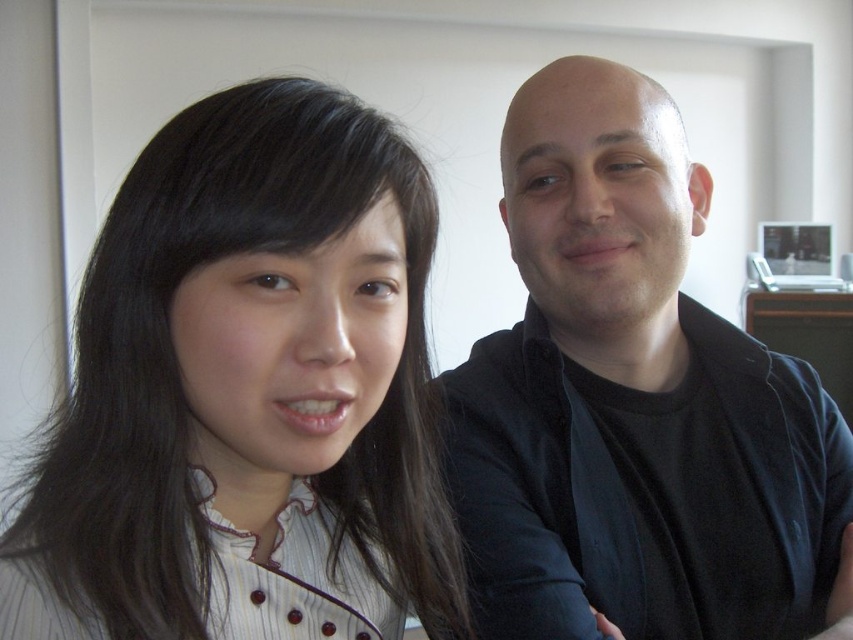
Question: Does matte black hair at left lie in front of black matte shirt at right?

Choices:
 (A) yes
 (B) no

Answer: (A)

Question: From the image, what is the correct spatial relationship of matte black hair at left in relation to black matte shirt at right?

Choices:
 (A) right
 (B) left

Answer: (B)

Question: Which point appears closest to the camera in this image?

Choices:
 (A) (415, 252)
 (B) (537, 499)

Answer: (A)

Question: Among these objects, which one is farthest from the camera?

Choices:
 (A) matte black hair at left
 (B) black matte shirt at right

Answer: (B)

Question: Is matte black hair at left further to camera compared to black matte shirt at right?

Choices:
 (A) yes
 (B) no

Answer: (B)